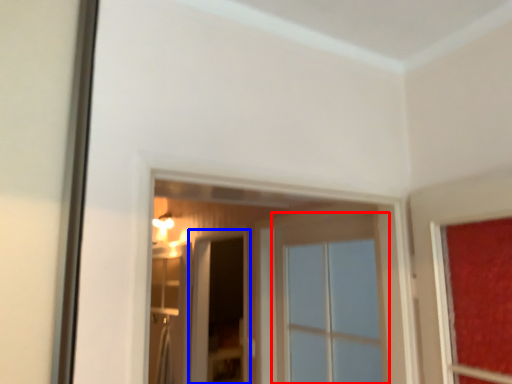
Question: Among these objects, which one is nearest to the camera, window (highlighted by a red box) or screen door (highlighted by a blue box)?

Choices:
 (A) window
 (B) screen door

Answer: (A)